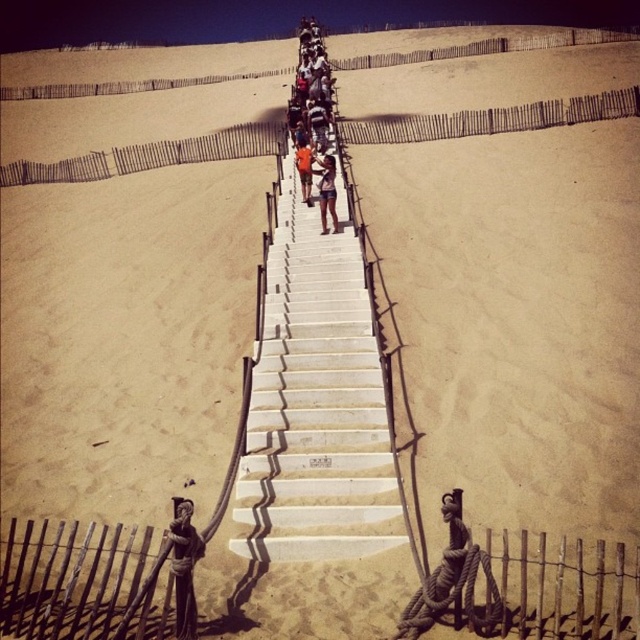
Question: Does white concrete stairs at center appear over orange fabric shorts at center?

Choices:
 (A) yes
 (B) no

Answer: (B)

Question: Which of the following is the closest to the observer?

Choices:
 (A) (352, 516)
 (B) (188, 564)

Answer: (B)

Question: Can you confirm if wooden statue at center is positioned to the left of orange fabric shorts at center?

Choices:
 (A) no
 (B) yes

Answer: (B)

Question: Which point is closer to the camera?

Choices:
 (A) wooden statue at center
 (B) white concrete stairs at center
 (C) orange fabric shorts at center
 (D) light brown shorts at center

Answer: (A)

Question: Which object appears farthest from the camera in this image?

Choices:
 (A) white concrete stairs at center
 (B) light brown shorts at center
 (C) wooden statue at center
 (D) orange fabric shorts at center

Answer: (D)

Question: Observing the image, what is the correct spatial positioning of light brown shorts at center in reference to orange fabric shorts at center?

Choices:
 (A) left
 (B) right

Answer: (B)